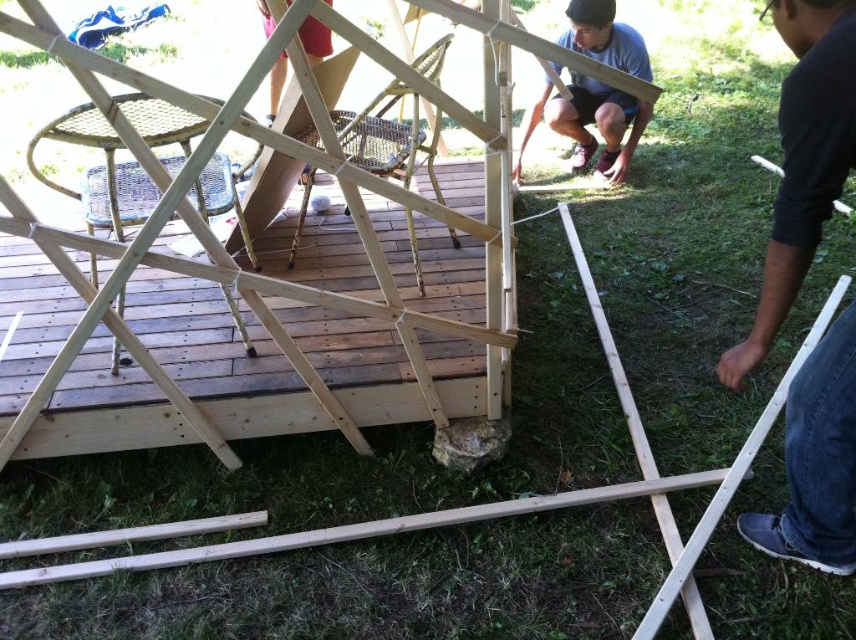
Question: Is natural wood deck at center bigger than matte wood person at center?

Choices:
 (A) no
 (B) yes

Answer: (B)

Question: Is dark blue jeans at lower right to the left of matte wood person at center from the viewer's perspective?

Choices:
 (A) no
 (B) yes

Answer: (A)

Question: Among these points, which one is nearest to the camera?

Choices:
 (A) (795, 461)
 (B) (617, 138)

Answer: (A)

Question: Which point is closer to the camera taking this photo?

Choices:
 (A) (253, 403)
 (B) (616, 60)
 (C) (828, 48)

Answer: (C)

Question: Is natural wood deck at center behind dark blue jeans at lower right?

Choices:
 (A) no
 (B) yes

Answer: (B)

Question: Which of the following is the closest to the observer?

Choices:
 (A) natural wood deck at center
 (B) dark blue jeans at lower right

Answer: (B)